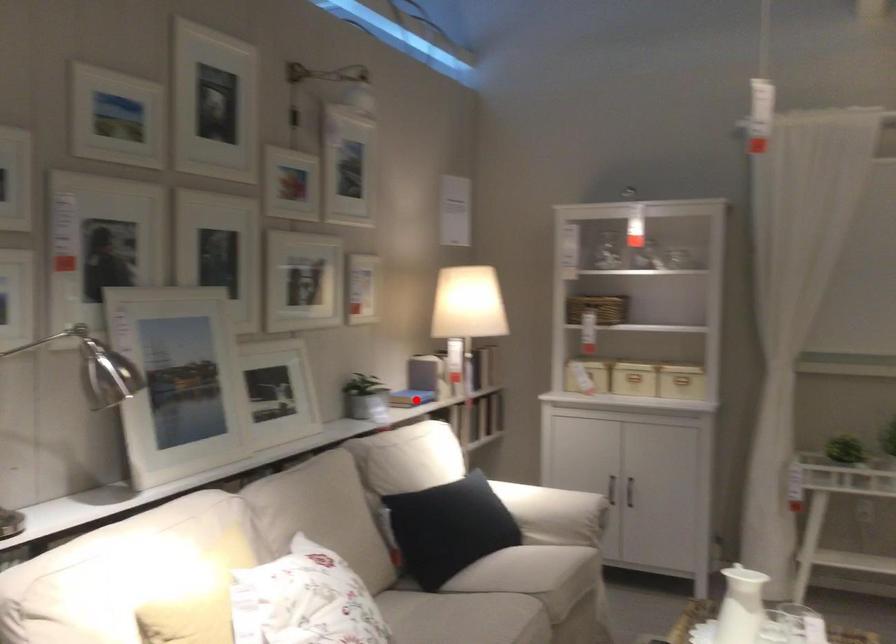
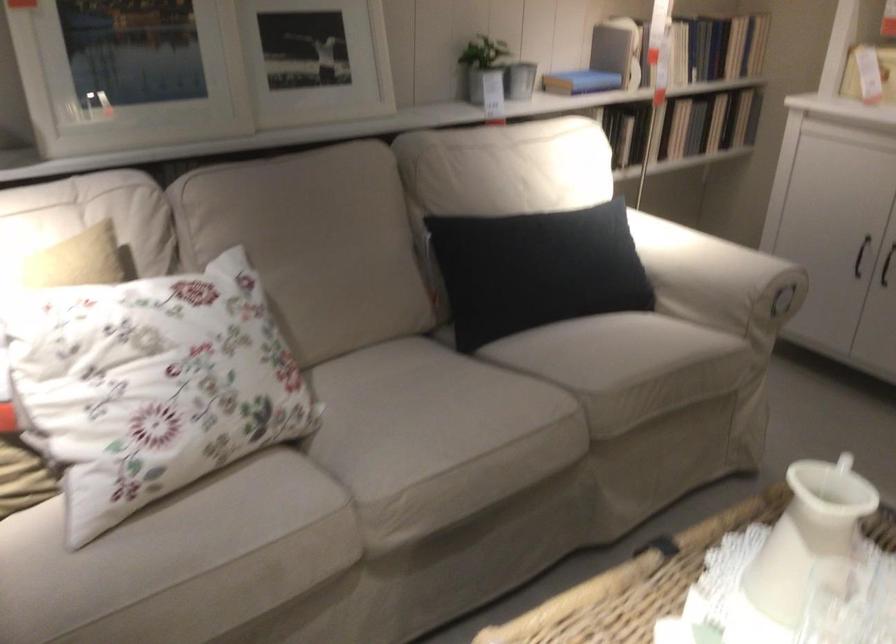
Question: A red point is marked in image1. In image2, is the corresponding 3D point closer to the camera or farther? Reply with the corresponding letter.

Choices:
 (A) The corresponding 3D point is closer.
 (B) The corresponding 3D point is farther.

Answer: (A)